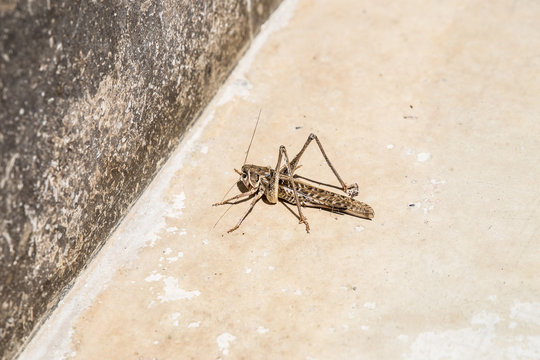
The width and height of the screenshot is (540, 360). In order to click on area where floor meets wall in this screenshot , I will do `click(178, 145)`.